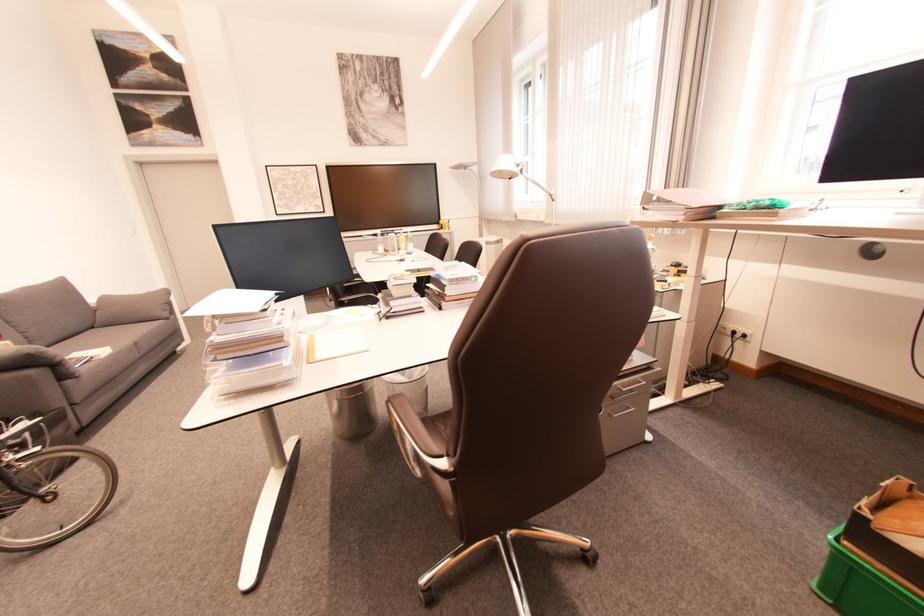
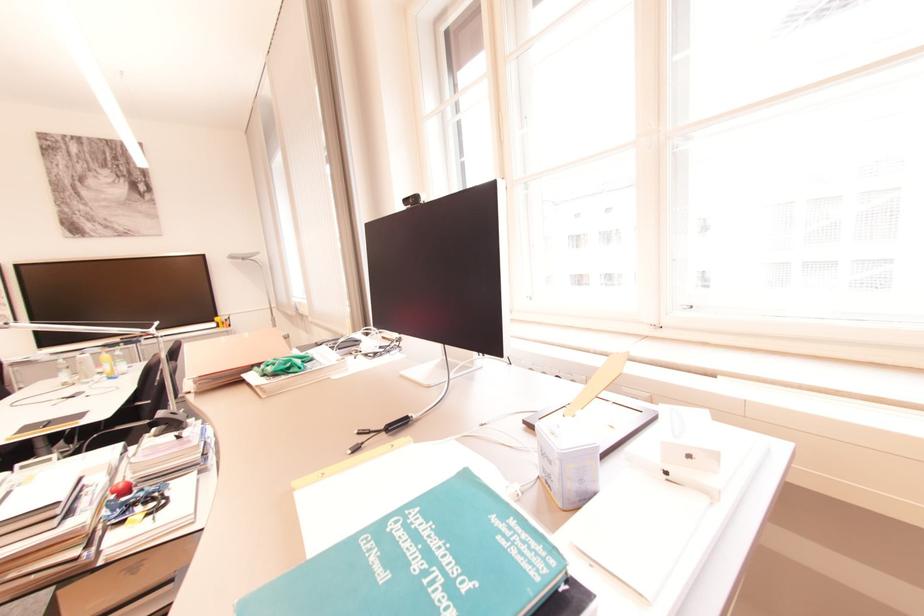
Question: Which direction would the cameraman need to move to produce the second image? Reply with the corresponding letter.

Choices:
 (A) Left
 (B) Right
 (C) Forward
 (D) Backward

Answer: (B)